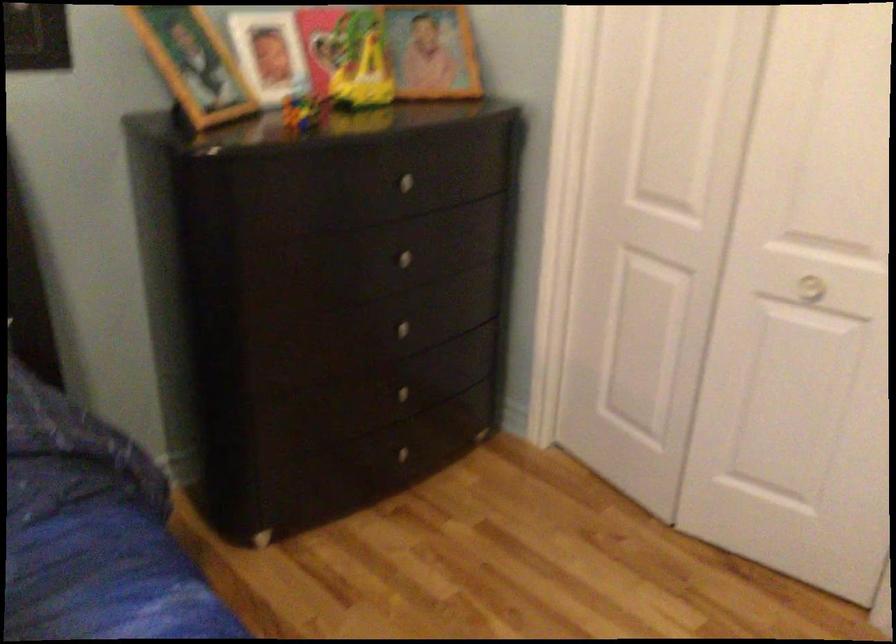
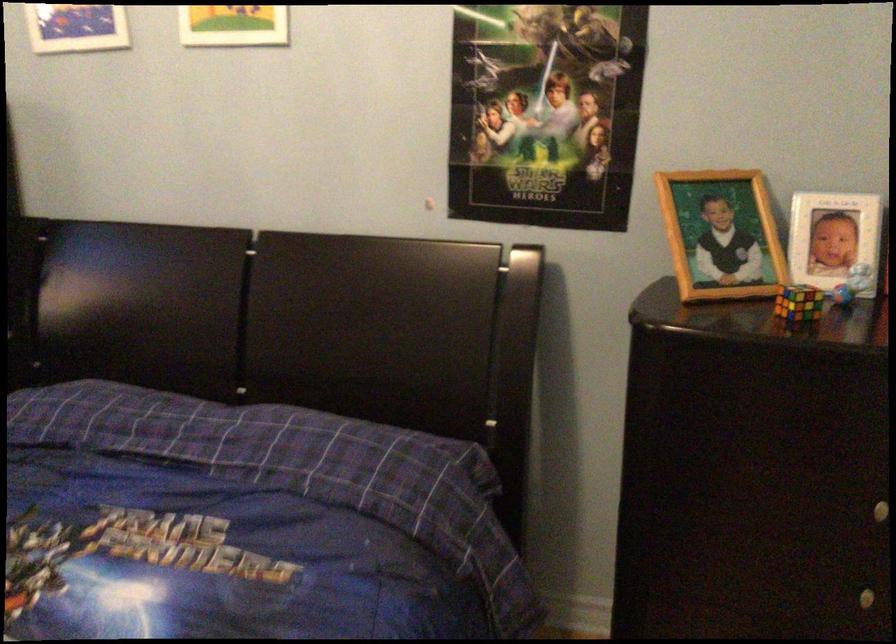
Question: I am providing you with two images of the same scene from different viewpoints. Please identify which objects are invisible in image2.

Choices:
 (A) white picture frame
 (B) small blue toy
 (C) multicolored Rubik's cube
 (D) none of these

Answer: (D)